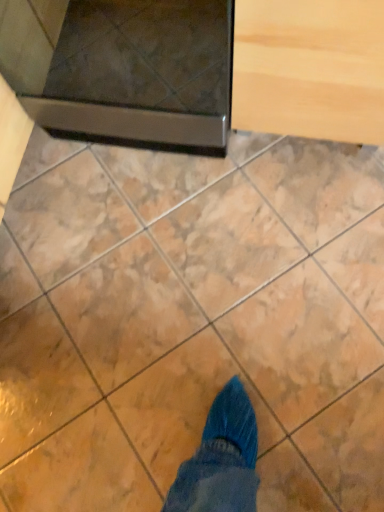
Measure the distance between point (112, 189) and camera.

Point (112, 189) is 3.83 feet away from camera.

The height and width of the screenshot is (512, 384). I want to click on metallic dark gray oven at upper left, so click(x=123, y=68).

Considering the relative sizes of light wood drawer at upper right and marble at upper center in the image provided, is light wood drawer at upper right bigger than marble at upper center?

Indeed, light wood drawer at upper right has a larger size compared to marble at upper center.

Could you tell me if light wood drawer at upper right is facing marble at upper center?

Yes, light wood drawer at upper right is oriented towards marble at upper center.

Which of these two, light wood drawer at upper right or marble at upper center, stands shorter?

marble at upper center.

Is point (293, 45) positioned in front of point (305, 264)?

Yes, it is in front of point (305, 264).

Which object is positioned more to the right, marble at upper center or metallic dark gray oven at upper left?

Positioned to the right is marble at upper center.

From a real-world perspective, is marble at upper center under metallic dark gray oven at upper left?

Correct, in the physical world, marble at upper center is lower than metallic dark gray oven at upper left.

Who is bigger, marble at upper center or metallic dark gray oven at upper left?

Bigger between the two is metallic dark gray oven at upper left.

Does marble at upper center lie behind metallic dark gray oven at upper left?

Yes.

Can you tell me how much metallic dark gray oven at upper left and marble at upper center differ in facing direction?

metallic dark gray oven at upper left and marble at upper center are facing 179 degrees away from each other.

Looking at this image, based on their positions, is metallic dark gray oven at upper left located to the left or right of marble at upper center?

From the image, it's evident that metallic dark gray oven at upper left is to the left of marble at upper center.

Identify the location of appliance that is on the left side of marble at upper center. pos(123,68).

Is marble at upper center taller than light wood drawer at upper right?

Incorrect, the height of marble at upper center is not larger of that of light wood drawer at upper right.

Is marble at upper center placed right next to light wood drawer at upper right?

No, marble at upper center is not touching light wood drawer at upper right.

Can light wood drawer at upper right be found inside marble at upper center?

No, light wood drawer at upper right is not surrounded by marble at upper center.

Find the location of a particular element. drawer below the metallic dark gray oven at upper left (from the image's perspective) is located at coordinates (310, 68).

Is light wood drawer at upper right inside the boundaries of metallic dark gray oven at upper left, or outside?

light wood drawer at upper right is not inside metallic dark gray oven at upper left, it's outside.

Is point (342, 78) farther from viewer compared to point (180, 93)?

No, (342, 78) is in front of (180, 93).

In the scene shown: Is light wood drawer at upper right behind metallic dark gray oven at upper left?

No, light wood drawer at upper right is in front of metallic dark gray oven at upper left.

Which object is closer to the camera, metallic dark gray oven at upper left or light wood drawer at upper right?

light wood drawer at upper right is more forward.

Which of these two, metallic dark gray oven at upper left or light wood drawer at upper right, is wider?

metallic dark gray oven at upper left is wider.

Could light wood drawer at upper right be considered to be inside metallic dark gray oven at upper left?

No, light wood drawer at upper right is located outside of metallic dark gray oven at upper left.

Where is `drawer on the right of the marble at upper center`? Image resolution: width=384 pixels, height=512 pixels. drawer on the right of the marble at upper center is located at coordinates (310, 68).

In order to click on appliance in front of the marble at upper center in this screenshot , I will do `click(123, 68)`.

Considering their positions, is marble at upper center positioned closer to light wood drawer at upper right than metallic dark gray oven at upper left?

metallic dark gray oven at upper left is closer to light wood drawer at upper right.

Which object lies further to the anchor point marble at upper center, metallic dark gray oven at upper left or light wood drawer at upper right?

Among the two, light wood drawer at upper right is located further to marble at upper center.

Estimate the real-world distances between objects in this image. Which object is closer to metallic dark gray oven at upper left, marble at upper center or light wood drawer at upper right?

light wood drawer at upper right.

From the image, which object appears to be farther from metallic dark gray oven at upper left, light wood drawer at upper right or marble at upper center?

Among the two, marble at upper center is located further to metallic dark gray oven at upper left.

Estimate the real-world distances between objects in this image. Which object is further from light wood drawer at upper right, metallic dark gray oven at upper left or marble at upper center?

marble at upper center lies further to light wood drawer at upper right than the other object.

Estimate the real-world distances between objects in this image. Which object is closer to marble at upper center, light wood drawer at upper right or metallic dark gray oven at upper left?

metallic dark gray oven at upper left is positioned closer to the anchor marble at upper center.

Locate an element on the screen. drawer between metallic dark gray oven at upper left and marble at upper center from top to bottom is located at coordinates (310, 68).